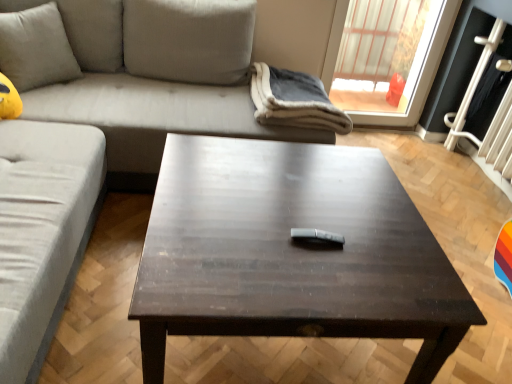
The height and width of the screenshot is (384, 512). I want to click on free spot to the left of black glass screen door at upper right, so click(x=401, y=148).